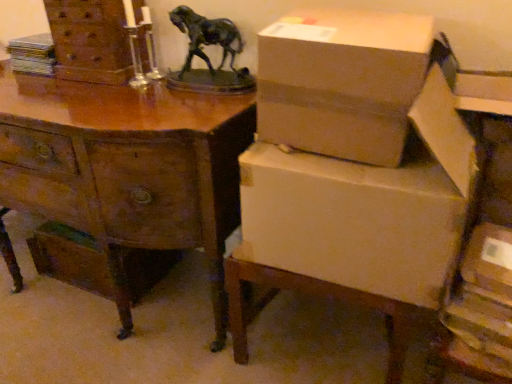
Identify the location of free space in front of wooden chest of drawers at upper left. 80,102.